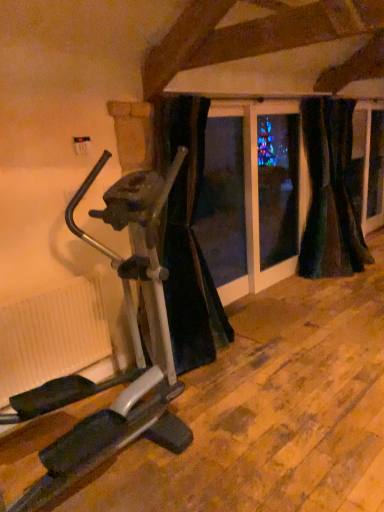
Question: Is black velvet curtain at center, which is the 3th curtain in right-to-left order, situated inside white ribbed radiator at lower left or outside?

Choices:
 (A) outside
 (B) inside

Answer: (A)

Question: From the image's perspective, is black velvet curtain at center, which is counted as the first curtain, starting from the left, positioned above or below white ribbed radiator at lower left?

Choices:
 (A) below
 (B) above

Answer: (B)

Question: Which object is positioned farthest from the white ribbed radiator at lower left?

Choices:
 (A) velvet dark green curtain at right, marked as the third curtain in a left-to-right arrangement
 (B) velvet dark green curtain at right, the 2th curtain positioned from the right
 (C) silver metallic stationary bicycle at left
 (D) black velvet curtain at center, which is counted as the first curtain, starting from the left

Answer: (A)

Question: Estimate the real-world distances between objects in this image. Which object is farther from the velvet dark green curtain at right, the 2th curtain positioned from the right?

Choices:
 (A) silver metallic stationary bicycle at left
 (B) velvet dark green curtain at right, positioned as the 1th curtain in right-to-left order
 (C) white ribbed radiator at lower left
 (D) black velvet curtain at center, which is the 3th curtain in right-to-left order

Answer: (C)